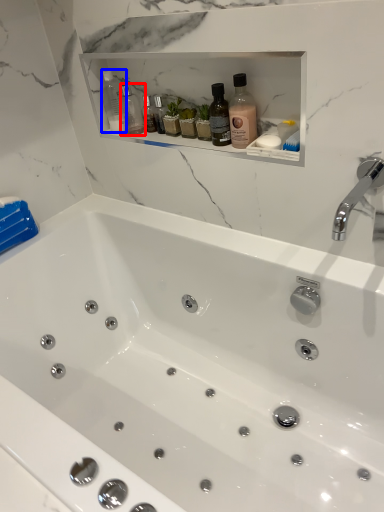
Question: Which object is closer to the camera taking this photo, bottle (highlighted by a red box) or bottle (highlighted by a blue box)?

Choices:
 (A) bottle
 (B) bottle

Answer: (B)